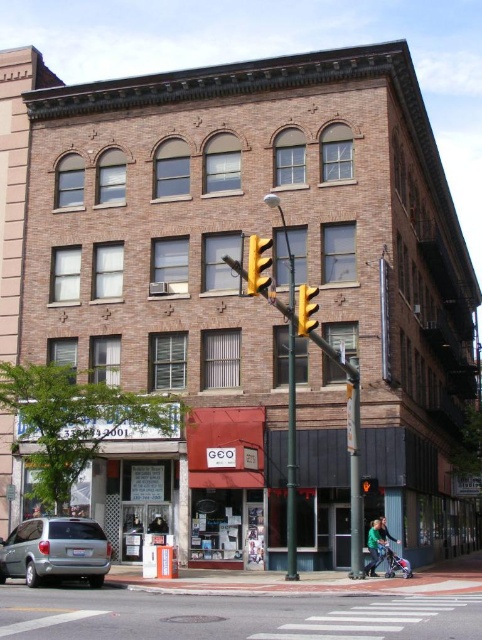
You are driving a car and see the silver metallic minivan at lower left and the yellow metallic traffic light at center. Which object is closer to you?

The silver metallic minivan at lower left is closer to you because it has a smaller size compared to the yellow metallic traffic light at center, indicating it is farther away.

You are a delivery driver approaching the intersection and see the yellow metallic traffic light at center and the yellow matte traffic light at center. Which one is taller?

The yellow metallic traffic light at center is taller than the yellow matte traffic light at center.